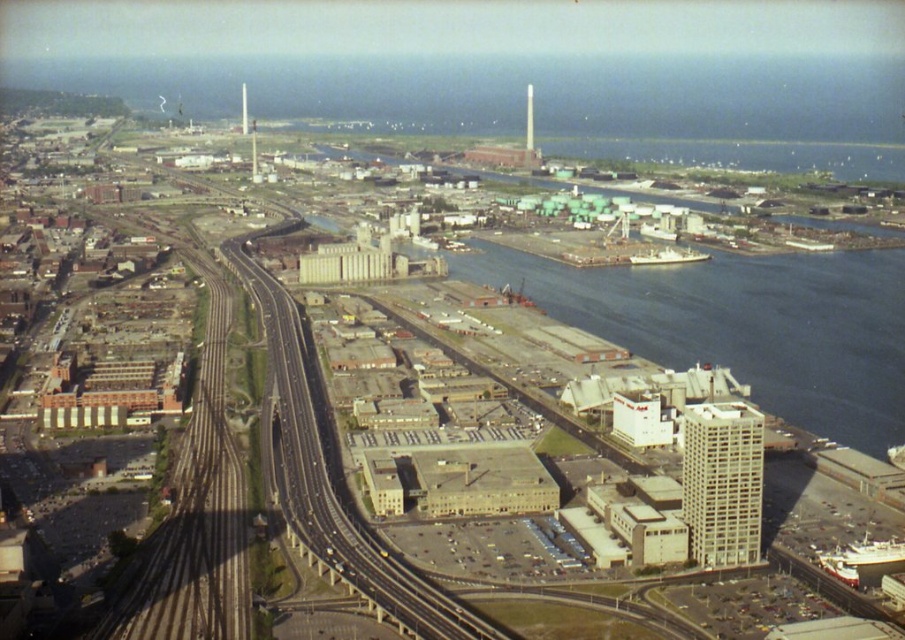
Question: Can you confirm if blue water at center is smaller than concrete railway at center?

Choices:
 (A) yes
 (B) no

Answer: (B)

Question: Is blue water at center wider than concrete railway at center?

Choices:
 (A) yes
 (B) no

Answer: (A)

Question: Does blue water at center appear on the right side of concrete railway at center?

Choices:
 (A) yes
 (B) no

Answer: (A)